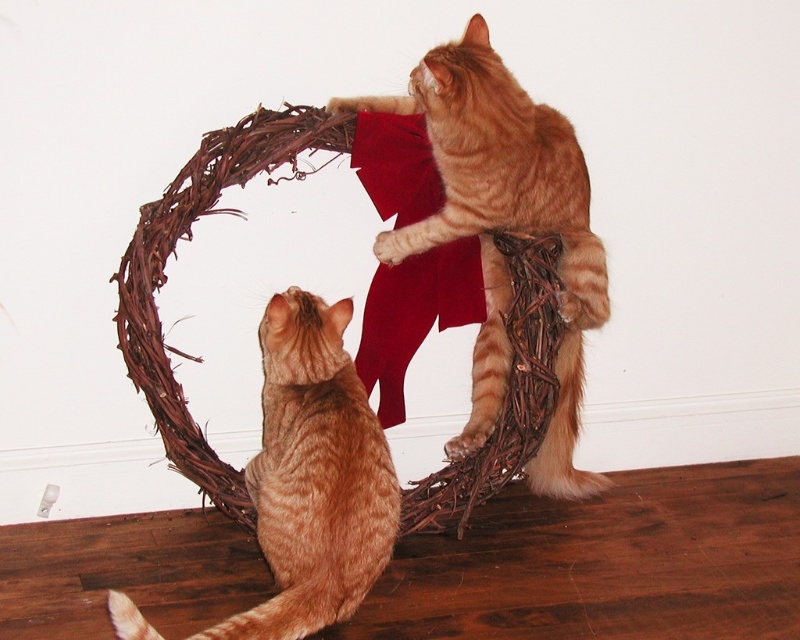
Question: Among these points, which one is farthest from the camera?

Choices:
 (A) (584, 268)
 (B) (122, 625)

Answer: (A)

Question: Does orange fur cat at upper center have a larger size compared to orange tabby cat at center?

Choices:
 (A) yes
 (B) no

Answer: (A)

Question: Among these objects, which one is nearest to the camera?

Choices:
 (A) orange fur cat at upper center
 (B) orange tabby cat at center

Answer: (B)

Question: Which point is closer to the camera?

Choices:
 (A) (x=270, y=364)
 (B) (x=418, y=228)

Answer: (A)

Question: Can you confirm if orange fur cat at upper center is positioned above orange tabby cat at center?

Choices:
 (A) yes
 (B) no

Answer: (A)

Question: Does orange fur cat at upper center appear over orange tabby cat at center?

Choices:
 (A) no
 (B) yes

Answer: (B)